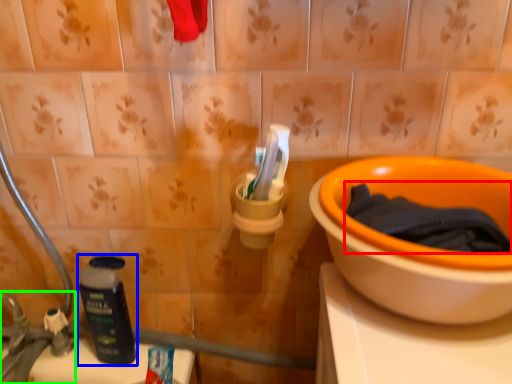
Question: Based on their relative distances, which object is farther from bath towel (highlighted by a red box)? Choose from bottle (highlighted by a blue box) and faucet (highlighted by a green box).

Choices:
 (A) bottle
 (B) faucet

Answer: (B)